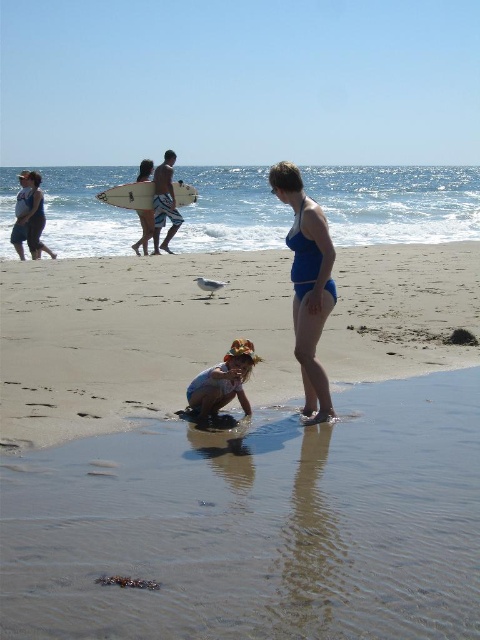
You are standing on the sandy beach at lower center and want to reach the white matte surfboard at upper center. Which direction should you move to get closer to the surfboard?

The sandy beach at lower center is closer to the viewer than the white matte surfboard at upper center. To reach the surfboard, you should move forward towards the upper part of the scene since the surfboard is positioned further away in the upper center.

Consider the image. You are a photographer trying to capture the entire beach scene. You notice the sandy beach at lower center and the white matte surfboard at upper center. Which object should you focus on first if you want to ensure both are in frame without moving the camera?

The sandy beach at lower center has a greater height compared to the white matte surfboard at upper center. To ensure both are in frame, focus on the taller sandy beach at lower center first, then adjust to include the shorter white matte surfboard at upper center.